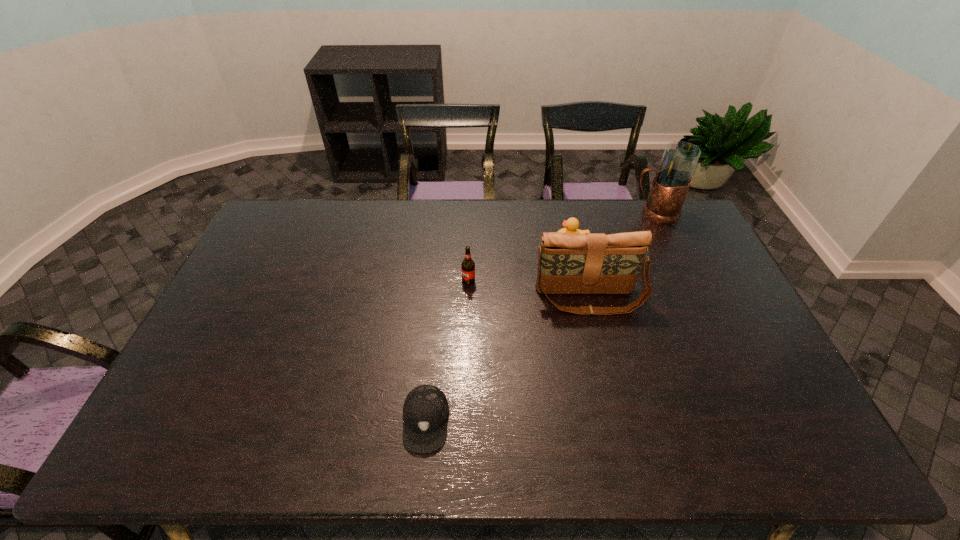
The image size is (960, 540). I want to click on the rightmost object, so click(x=671, y=183).

Identify the location of the farthest object. The image size is (960, 540). (671, 183).

What are the coordinates of `shoulder bag` in the screenshot? It's located at tap(592, 263).

The image size is (960, 540). In order to click on the second object from left to right in this screenshot , I will do `click(468, 265)`.

This screenshot has height=540, width=960. Identify the location of root beer. (468, 265).

The width and height of the screenshot is (960, 540). Identify the location of the second shortest object. (572, 224).

The height and width of the screenshot is (540, 960). I want to click on duck, so click(572, 224).

The width and height of the screenshot is (960, 540). I want to click on the shortest object, so click(x=425, y=411).

Locate an element on the screen. This screenshot has width=960, height=540. the nearest object is located at coordinates (425, 411).

The height and width of the screenshot is (540, 960). What are the coordinates of `vacant region located with the handle on the side of the farthest object` in the screenshot? It's located at (544, 212).